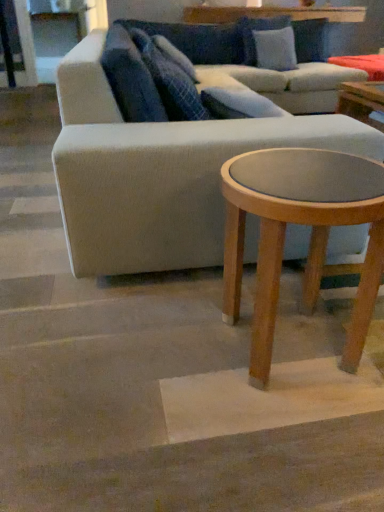
This screenshot has height=512, width=384. Identify the location of vacant space underneath light brown wood coffee table at lower right (from a real-world perspective). click(x=286, y=344).